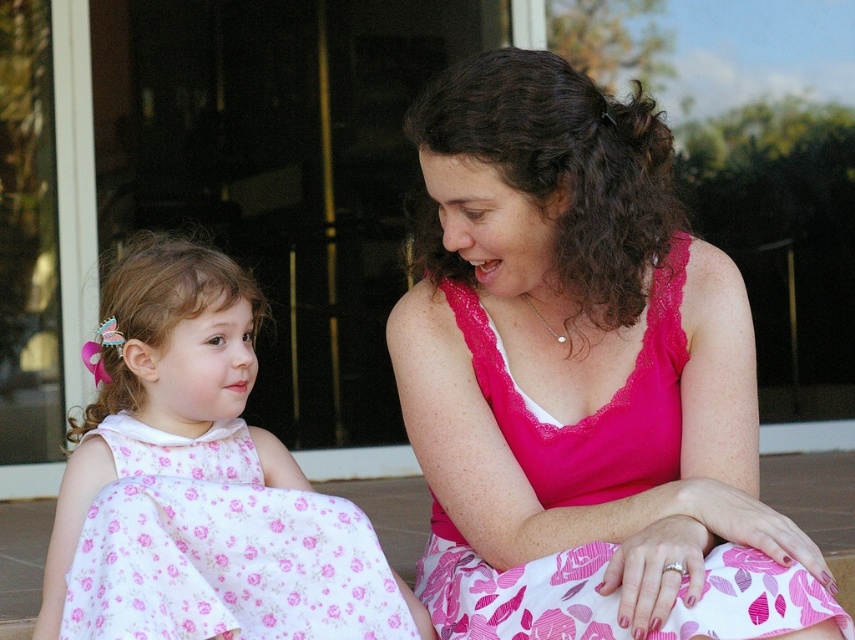
Question: Does white floral dress at left have a smaller size compared to pink floral fabric dress at center?

Choices:
 (A) yes
 (B) no

Answer: (B)

Question: Is white floral dress at left closer to camera compared to pink floral fabric dress at center?

Choices:
 (A) yes
 (B) no

Answer: (B)

Question: Which point is farther from the camera taking this photo?

Choices:
 (A) (317, 605)
 (B) (733, 605)

Answer: (A)

Question: Does white floral dress at left have a smaller size compared to pink floral fabric dress at center?

Choices:
 (A) no
 (B) yes

Answer: (A)